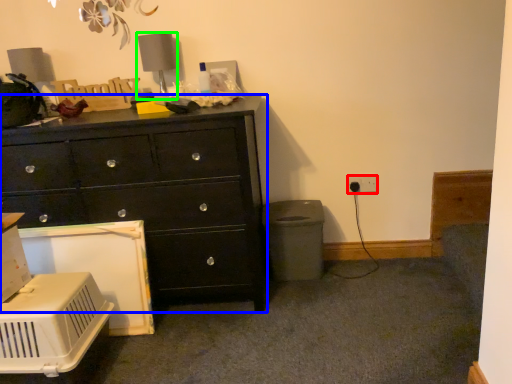
Question: Which object is positioned closest to electric outlet (highlighted by a red box)? Select from chest of drawers (highlighted by a blue box) and table lamp (highlighted by a green box).

Choices:
 (A) chest of drawers
 (B) table lamp

Answer: (A)